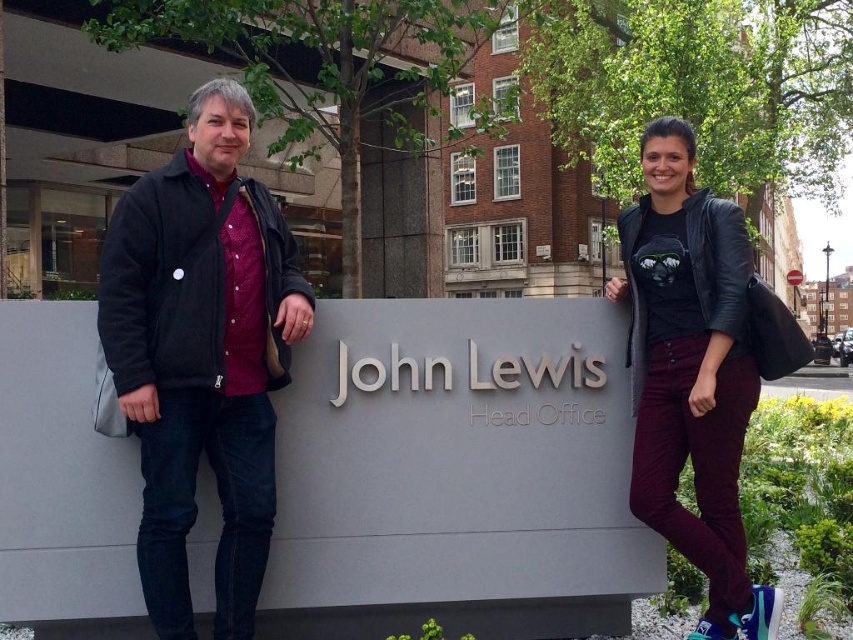
Question: Among these objects, which one is farthest from the camera?

Choices:
 (A) matte black jacket at left
 (B) black leather jacket at right
 (C) black fleece jacket at left

Answer: (A)

Question: Considering the real-world distances, which object is farthest from the black leather jacket at right?

Choices:
 (A) matte black jacket at left
 (B) black fleece jacket at left

Answer: (B)

Question: Can you confirm if matte black jacket at left is positioned to the left of black fleece jacket at left?

Choices:
 (A) no
 (B) yes

Answer: (A)

Question: Which point appears farthest from the camera in this image?

Choices:
 (A) (190, 300)
 (B) (654, 296)
 (C) (648, 252)

Answer: (B)

Question: Is matte black jacket at left thinner than black leather jacket at right?

Choices:
 (A) yes
 (B) no

Answer: (B)

Question: Is matte black jacket at left thinner than black fleece jacket at left?

Choices:
 (A) no
 (B) yes

Answer: (B)